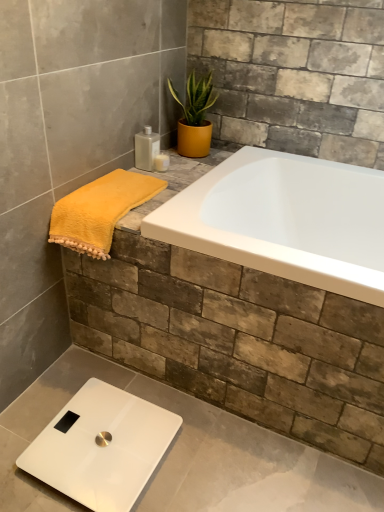
Find the location of a particular element. The width and height of the screenshot is (384, 512). blank space above white glossy scale at lower left (from a real-world perspective) is located at coordinates (97, 443).